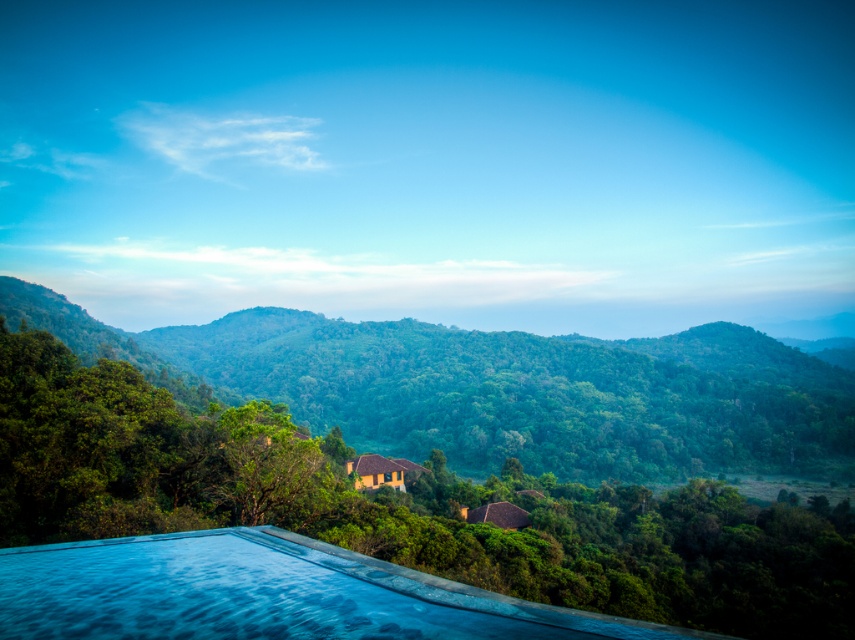
You are standing at the point marked by the coordinates (x=404, y=506) in the image. What object are you directly in front of?

The point (x=404, y=506) corresponds to the green leafy tree at center, so you are directly in front of the green leafy tree at center.

You are standing in the middle of the scene and want to walk towards the green leafy tree at center and the green leafy forest at center. Which one is closer to you?

The green leafy tree at center is closer to you because it is thinner than the green leafy forest at center, which is wider and further away.

You are standing at the edge of the pool in the scene. You see a green leafy tree at center and a green leafy forest at center. Which one is closer to your right side?

The green leafy tree at center is to the right of green leafy forest at center, so the green leafy tree at center is closer to your right side.